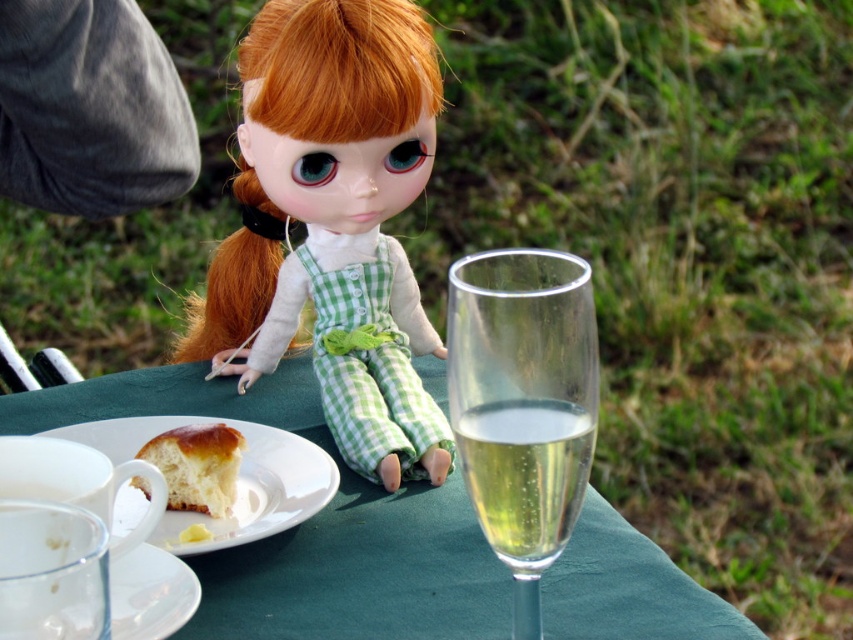
Question: Is clear glass wine glass at center to the right of golden brown bread at center from the viewer's perspective?

Choices:
 (A) no
 (B) yes

Answer: (B)

Question: Which point is closer to the camera?

Choices:
 (A) pyautogui.click(x=514, y=516)
 (B) pyautogui.click(x=209, y=417)
 (C) pyautogui.click(x=454, y=522)
 (D) pyautogui.click(x=558, y=285)

Answer: (A)

Question: Which is farther from the golden brown bread at center?

Choices:
 (A) transparent glass saucer at lower left
 (B) green fabric table at center

Answer: (B)

Question: Can you confirm if clear glass champagne flute at center is bigger than white ceramic plate at lower left?

Choices:
 (A) no
 (B) yes

Answer: (A)

Question: Is white ceramic plate at lower left positioned behind transparent glass saucer at lower left?

Choices:
 (A) yes
 (B) no

Answer: (A)

Question: Which point appears closest to the camera in this image?

Choices:
 (A) (250, 538)
 (B) (142, 608)

Answer: (B)